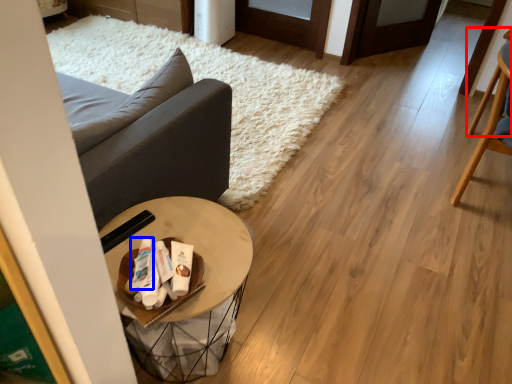
Question: Which of the following is the closest to the observer, chair (highlighted by a red box) or toiletry (highlighted by a blue box)?

Choices:
 (A) chair
 (B) toiletry

Answer: (B)